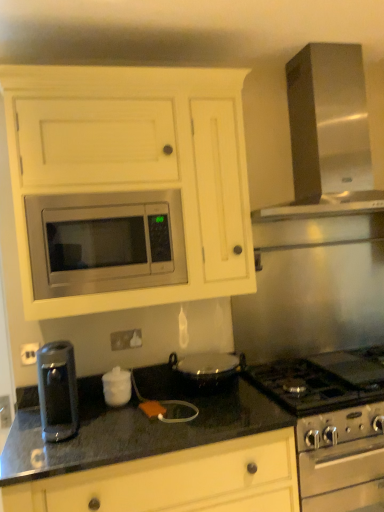
Identify the location of free space above satin silver exhaust hood at upper right (from a real-world perspective). The image size is (384, 512). (308, 32).